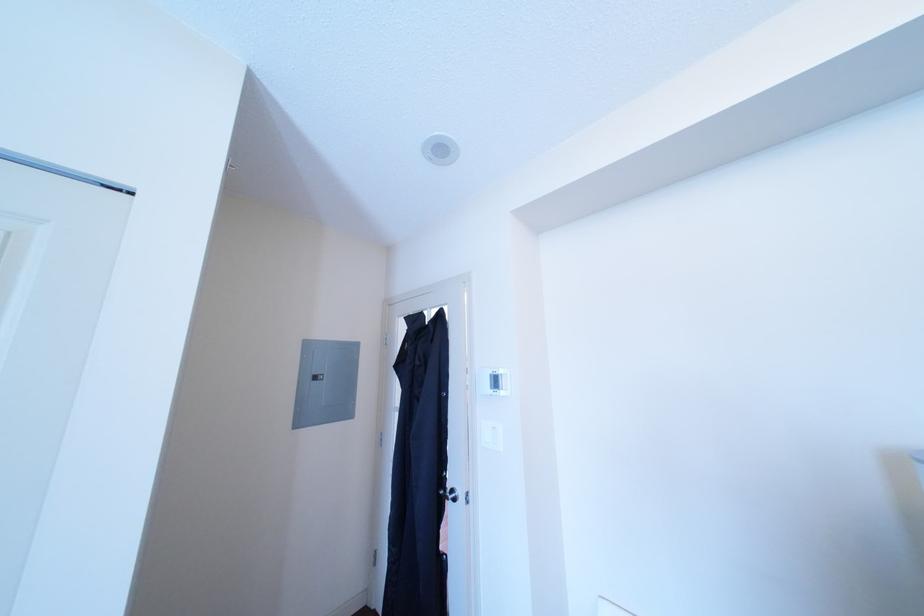
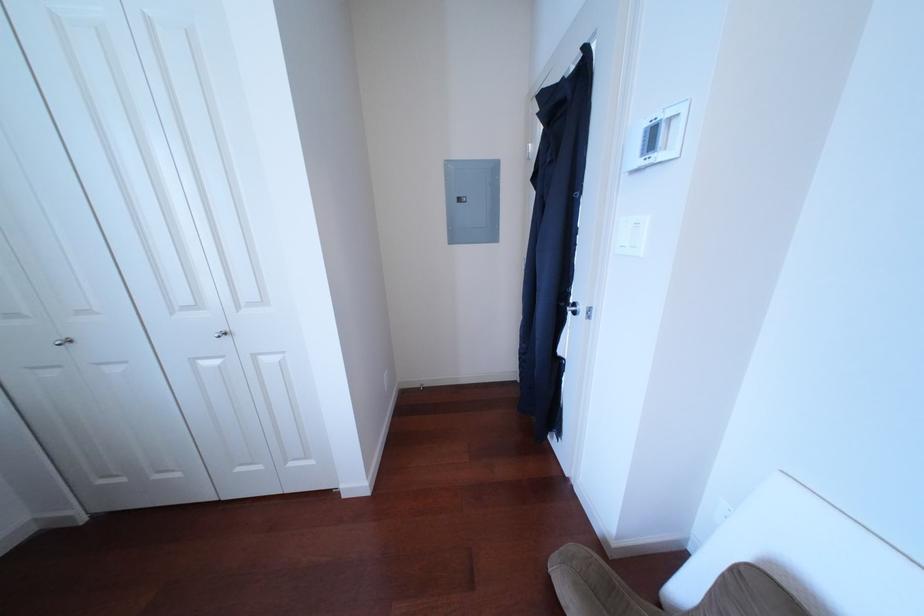
How did the camera likely rotate?

The rotation direction of the camera is left-down.